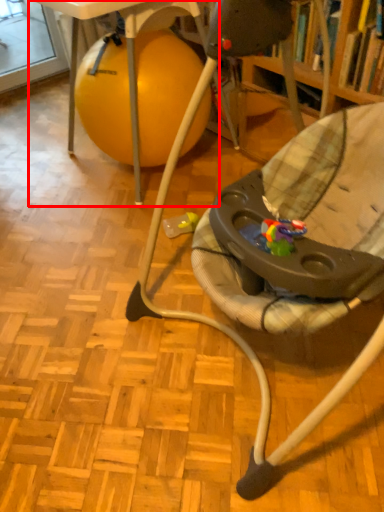
Question: From the image's perspective, considering the relative positions of table (annotated by the red box) and chair in the image provided, where is table (annotated by the red box) located with respect to the staircase?

Choices:
 (A) below
 (B) above

Answer: (B)